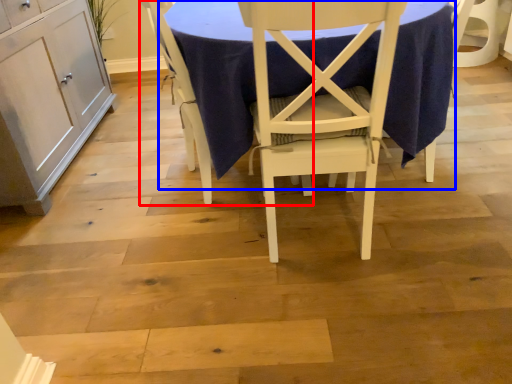
Question: Which point is further to the camera, chair (highlighted by a red box) or table (highlighted by a blue box)?

Choices:
 (A) chair
 (B) table

Answer: (A)